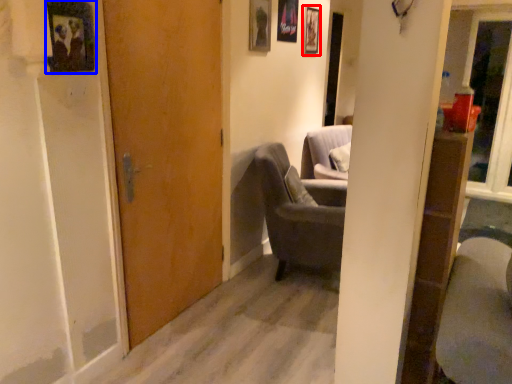
Question: Which object is further to the camera taking this photo, picture frame (highlighted by a red box) or picture frame (highlighted by a blue box)?

Choices:
 (A) picture frame
 (B) picture frame

Answer: (A)